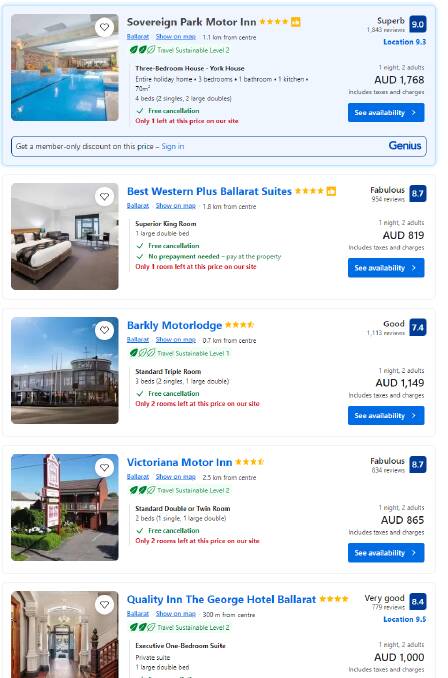
You are a GUI agent. You are given a task and a screenshot of the screen. Output one action in this format:
    pyautogui.click(x=<x>, y=<y>)
    Task: Click on the interior roof
    This screenshot has height=678, width=448.
    Given the screenshot: What is the action you would take?
    pyautogui.click(x=37, y=24), pyautogui.click(x=65, y=196), pyautogui.click(x=74, y=596)